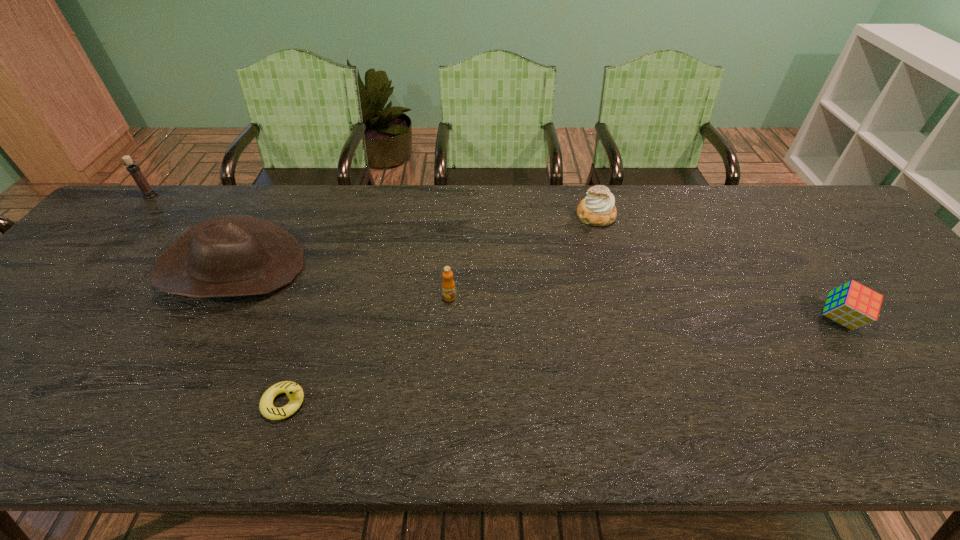
Locate an element on the screen. This screenshot has width=960, height=540. free location located 0.060m on the left of the cowboy hat is located at coordinates pos(141,268).

At what (x,y) coordinates should I click in order to perform the action: click on vacant space located on the left of the pastry. Please return your answer as a coordinate pair (x, y). The width and height of the screenshot is (960, 540). Looking at the image, I should click on (500, 216).

Where is `vacant space located on the front label of the orange juice`? vacant space located on the front label of the orange juice is located at coordinates (442, 420).

What are the coordinates of `vacant space situated 0.220m on the back of the cube` in the screenshot? It's located at (784, 242).

Where is `free spot located on the face of the fourth object from right to left`? The width and height of the screenshot is (960, 540). free spot located on the face of the fourth object from right to left is located at coordinates coord(454,403).

Identify the location of candle holder that is positioned at the far edge. (134, 170).

Where is `cowboy hat that is at the far edge`? cowboy hat that is at the far edge is located at coordinates pos(229,255).

Image resolution: width=960 pixels, height=540 pixels. What are the coordinates of `pastry that is at the far edge` in the screenshot? It's located at (597, 209).

Where is `object situated at the near edge`? The image size is (960, 540). object situated at the near edge is located at coordinates (294, 392).

Image resolution: width=960 pixels, height=540 pixels. I want to click on object positioned at the left edge, so click(x=134, y=170).